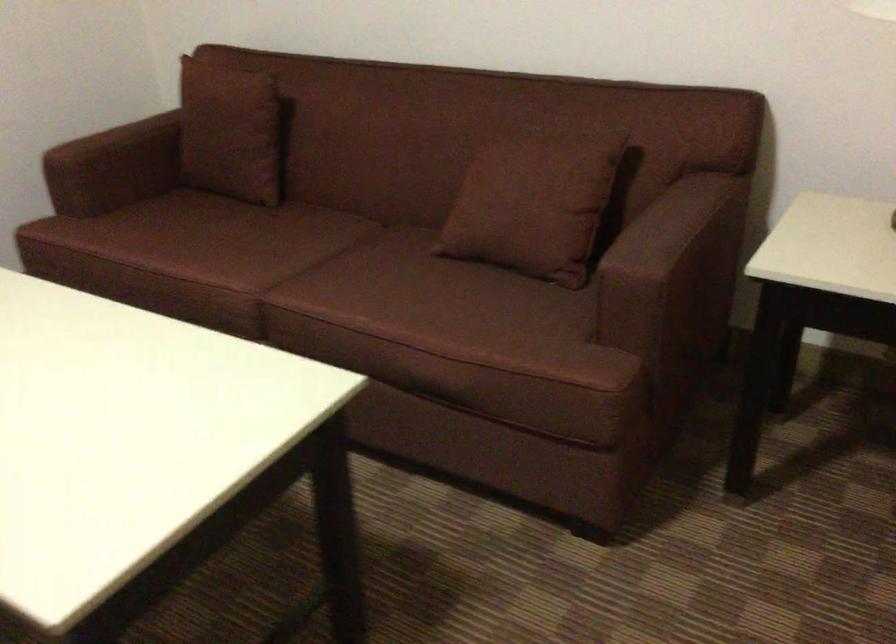
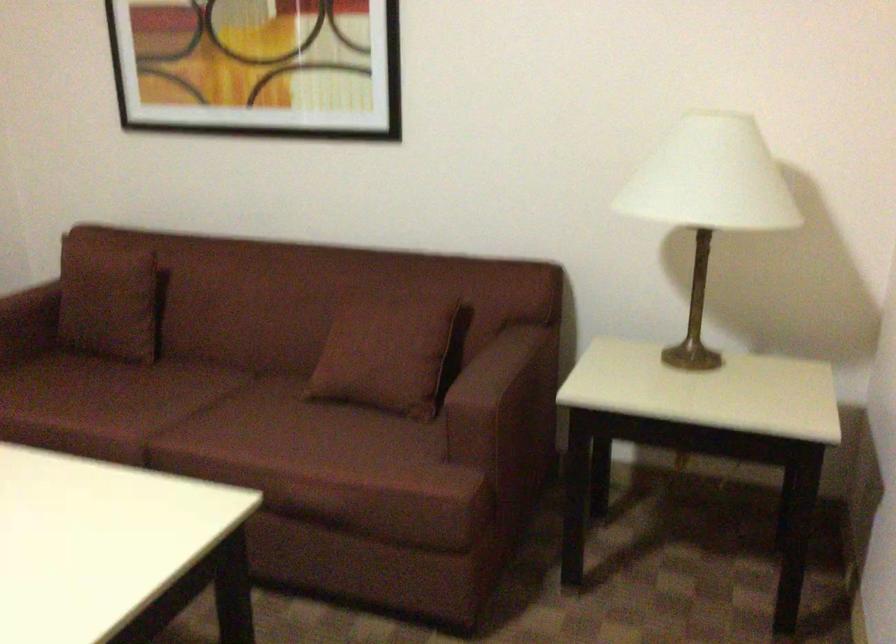
Question: What movement of the cameraman would produce the second image?

Choices:
 (A) Left
 (B) Right
 (C) Forward
 (D) Backward

Answer: (D)